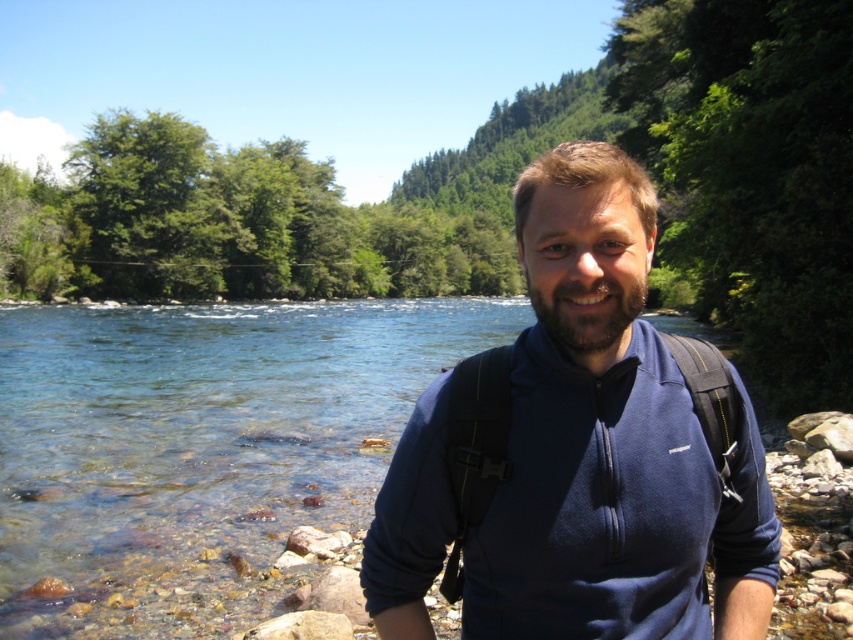
Question: Is clear water at river right bigger than blue fleece jacket at center?

Choices:
 (A) no
 (B) yes

Answer: (B)

Question: Which point is farther to the camera?

Choices:
 (A) blue fleece jacket at center
 (B) clear water at river right

Answer: (B)

Question: Considering the relative positions of clear water at river right and blue fleece jacket at center in the image provided, where is clear water at river right located with respect to blue fleece jacket at center?

Choices:
 (A) left
 (B) right

Answer: (A)

Question: Does clear water at river right come in front of blue fleece jacket at center?

Choices:
 (A) yes
 (B) no

Answer: (B)